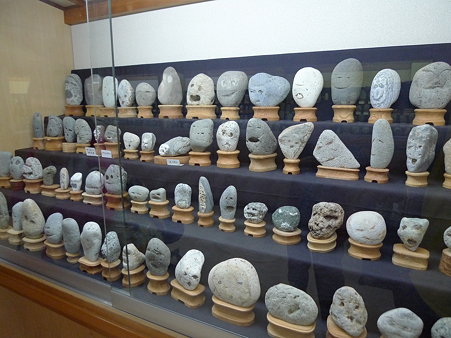
Identify the location of glass window. (60, 58), (191, 44).